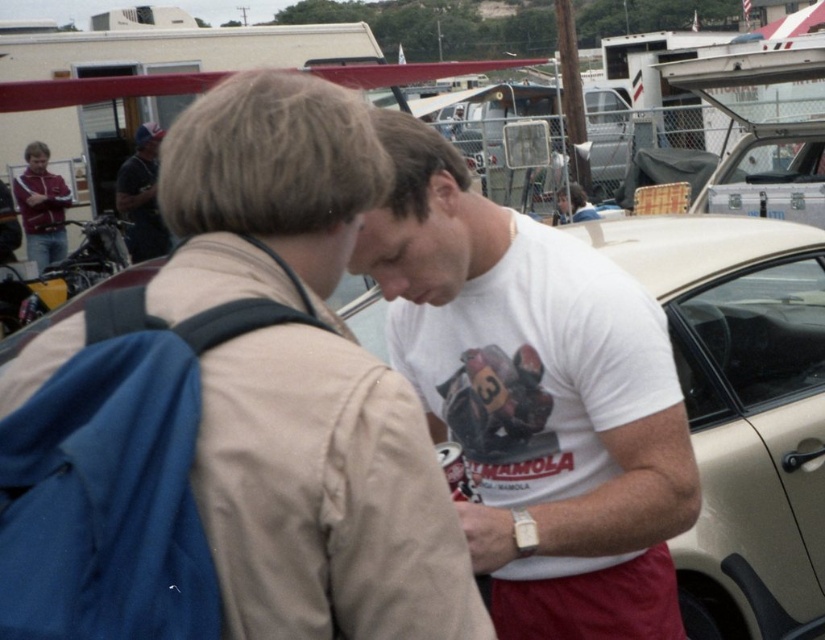
Does white cotton t-shirt at center appear under dark gray shirt at left?

Correct, white cotton t-shirt at center is located below dark gray shirt at left.

Who is more distant from viewer, (505, 314) or (132, 195)?

Positioned behind is point (132, 195).

Find the location of a particular element. The image size is (825, 640). white cotton t-shirt at center is located at coordinates (541, 392).

The height and width of the screenshot is (640, 825). Describe the element at coordinates (541, 392) in the screenshot. I see `white cotton t-shirt at center` at that location.

Which is in front, point (446, 310) or point (729, 589)?

Point (446, 310)

Measure the distance between point (623, 346) and camera.

Point (623, 346) and camera are 5.92 feet apart from each other.

Locate an element on the screen. white cotton t-shirt at center is located at coordinates (541, 392).

Who is more forward, (746, 396) or (140, 205)?

Point (746, 396) is more forward.

Which is below, beige matte car at right or dark gray shirt at left?

Positioned lower is beige matte car at right.

Identify the location of beige matte car at right. This screenshot has width=825, height=640. (741, 406).